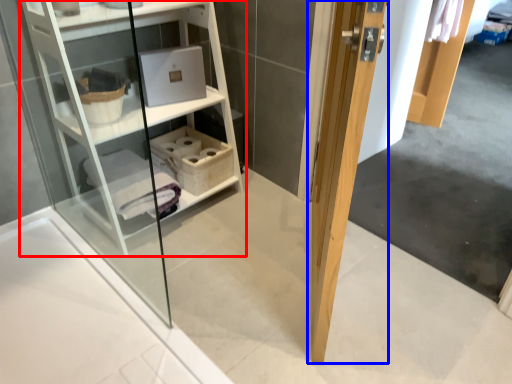
Question: Which point is further to the camera, shelf (highlighted by a red box) or door (highlighted by a blue box)?

Choices:
 (A) shelf
 (B) door

Answer: (A)